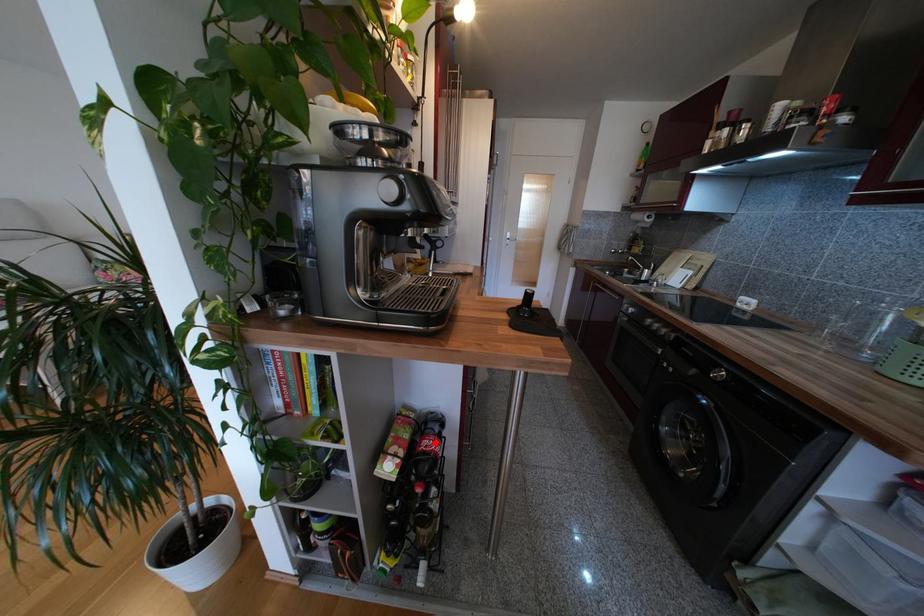
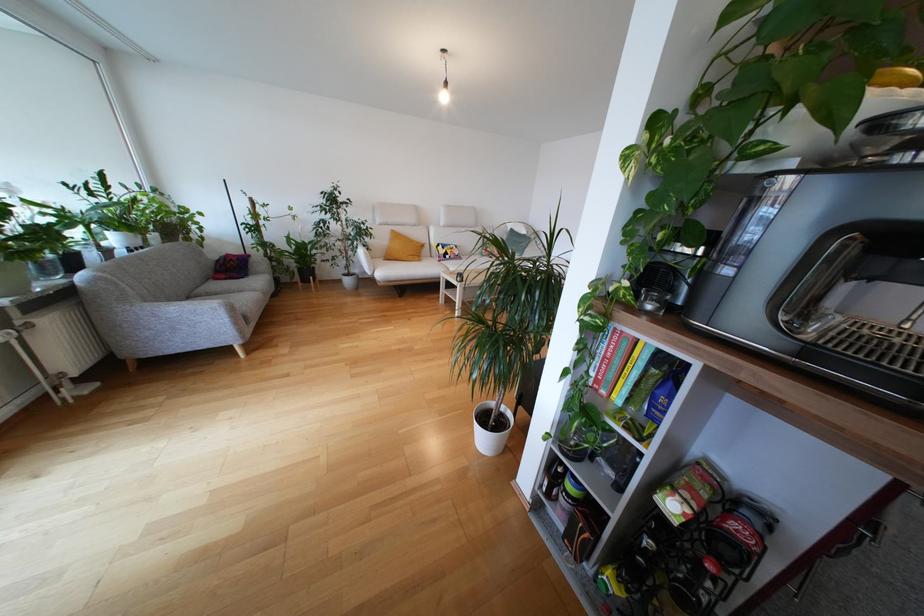
Find the pixel in the second image that matches the highlighted location in the first image.

(750, 533)